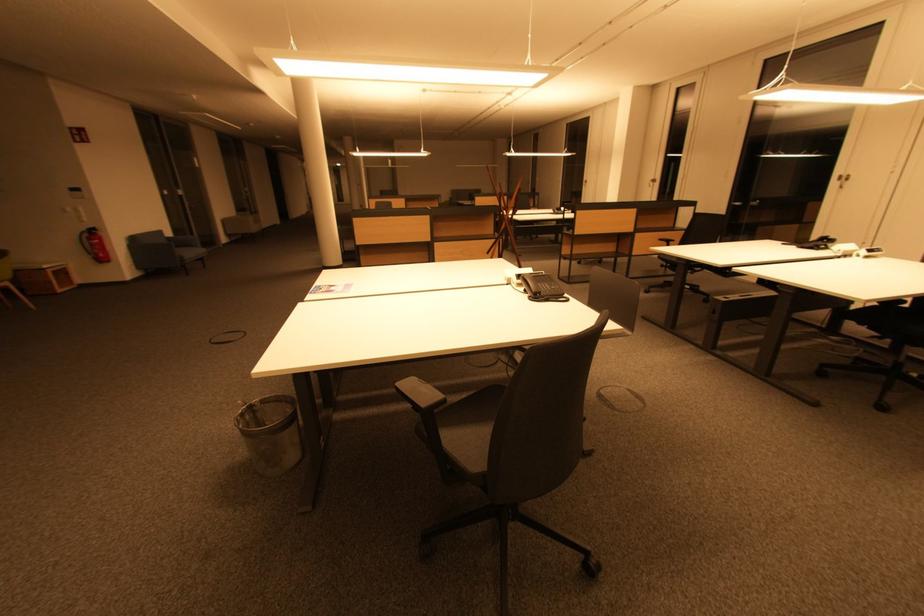
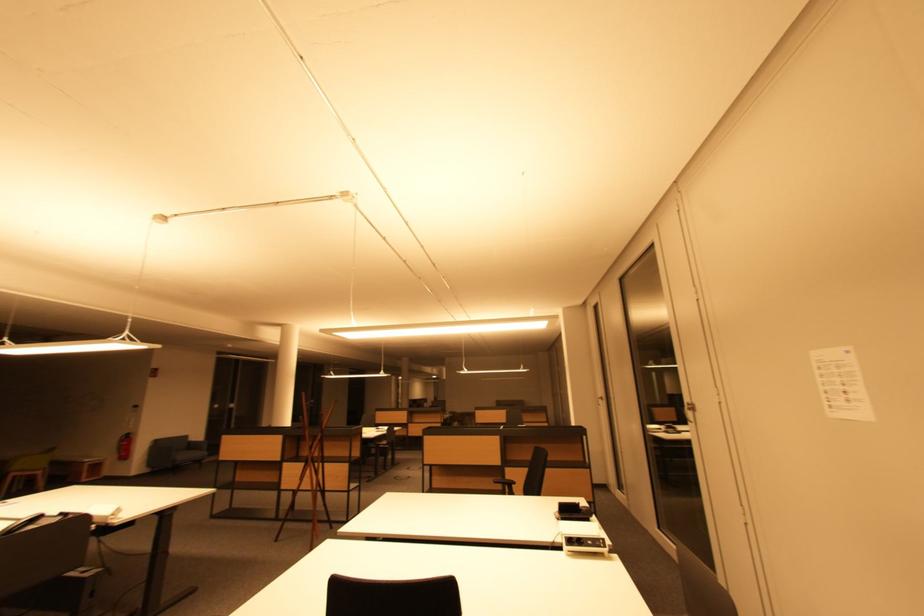
Where in the second image is the point corresponding to the point at 193,256 from the first image?

(188, 458)